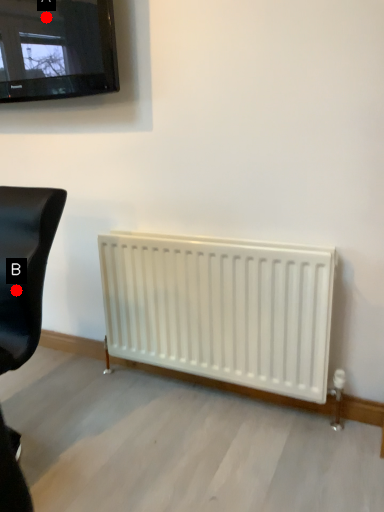
Question: Two points are circled on the image, labeled by A and B beside each circle. Which point appears farthest from the camera in this image?

Choices:
 (A) A is further
 (B) B is further

Answer: (A)